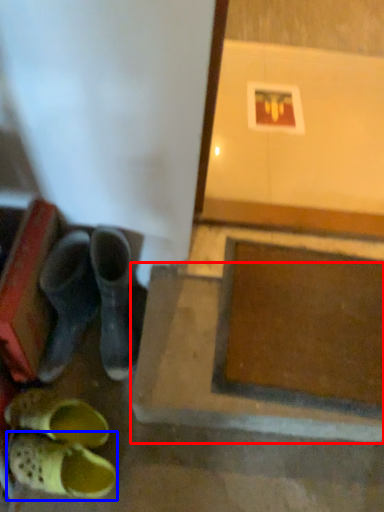
Question: Which object appears closest to the camera in this image, concrete (highlighted by a red box) or footwear (highlighted by a blue box)?

Choices:
 (A) concrete
 (B) footwear

Answer: (B)